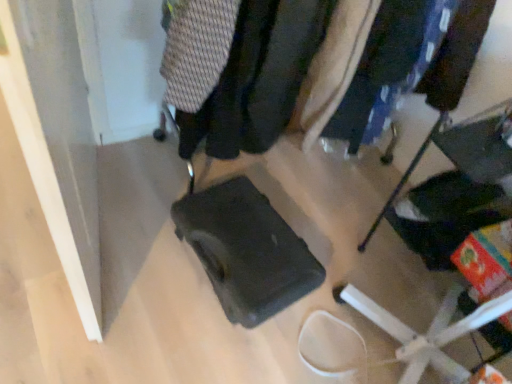
What are the coordinates of `knitted fabric sweater at upper center, which is the 1th clothing in left-to-right order` in the screenshot? It's located at (196, 49).

Locate an element on the screen. matte black suitcase at center is located at coordinates (246, 250).

Locate an element on the screen. matte black backpack at center, which is the second clothing from left to right is located at coordinates (263, 74).

I want to click on matte black suitcase at center, so click(309, 64).

The width and height of the screenshot is (512, 384). In order to click on knitted fabric sweater at upper center, the second clothing positioned from the right in this screenshot , I will do `click(196, 49)`.

From the image's perspective, which one is positioned lower, matte black suitcase at center or matte black suitcase at center?

matte black suitcase at center is shown below in the image.

Considering the sizes of matte black suitcase at center and matte black suitcase at center in the image, is matte black suitcase at center taller or shorter than matte black suitcase at center?

matte black suitcase at center is shorter than matte black suitcase at center.

Can you tell me how much matte black suitcase at center and matte black suitcase at center differ in facing direction?

They differ by 6.98 degrees in their facing directions.

In the scene shown: Which object is wider, matte black suitcase at center or matte black suitcase at center?

Wider between the two is matte black suitcase at center.

Is there a large distance between matte black suitcase at center and knitted fabric sweater at upper center, which is the 1th clothing in left-to-right order?

matte black suitcase at center is near knitted fabric sweater at upper center, which is the 1th clothing in left-to-right order, not far away.

Can you confirm if matte black suitcase at center is thinner than knitted fabric sweater at upper center, the second clothing positioned from the right?

Yes.

Is matte black suitcase at center bigger or smaller than knitted fabric sweater at upper center, the second clothing positioned from the right?

matte black suitcase at center is smaller than knitted fabric sweater at upper center, the second clothing positioned from the right.

Which is more to the right, matte black suitcase at center or knitted fabric sweater at upper center, which is the 1th clothing in left-to-right order?

matte black suitcase at center is more to the right.

Who is bigger, matte black suitcase at center or matte black suitcase at center?

With larger size is matte black suitcase at center.

From the image's perspective, which is below, matte black suitcase at center or matte black suitcase at center?

matte black suitcase at center appears lower in the image.

Would you say matte black suitcase at center contains matte black suitcase at center?

No.

Considering the relative sizes of matte black suitcase at center and matte black suitcase at center in the image provided, is matte black suitcase at center thinner than matte black suitcase at center?

Indeed, matte black suitcase at center has a lesser width compared to matte black suitcase at center.

Would you say matte black suitcase at center is part of matte black suitcase at center's contents?

No, matte black suitcase at center is not a part of matte black suitcase at center.

From a real-world perspective, which is physically below, matte black suitcase at center or matte black suitcase at center?

In real-world perspective, matte black suitcase at center is lower.

From the image's perspective, which is above, matte black suitcase at center or matte black suitcase at center?

matte black suitcase at center is shown above in the image.

Which object is thinner, knitted fabric sweater at upper center, the second clothing positioned from the right, or matte black backpack at center, which is the second clothing from left to right?

matte black backpack at center, which is the second clothing from left to right, is thinner.

From the image's perspective, who appears lower, knitted fabric sweater at upper center, which is the 1th clothing in left-to-right order, or matte black backpack at center, which is the second clothing from left to right?

matte black backpack at center, which is the second clothing from left to right, from the image's perspective.

Who is more distant, knitted fabric sweater at upper center, the second clothing positioned from the right, or matte black backpack at center, which is the second clothing from left to right?

Positioned behind is matte black backpack at center, which is the second clothing from left to right.

Could you tell me if knitted fabric sweater at upper center, the second clothing positioned from the right, is facing matte black backpack at center, marked as the 1th clothing in a right-to-left arrangement?

No.

Looking at this image, can you tell me how much matte black backpack at center, marked as the 1th clothing in a right-to-left arrangement, and matte black suitcase at center differ in facing direction?

64.2 degrees.

Does matte black backpack at center, which is the second clothing from left to right, touch matte black suitcase at center?

No, matte black backpack at center, which is the second clothing from left to right, is not with matte black suitcase at center.

Is matte black backpack at center, which is the second clothing from left to right, inside the boundaries of matte black suitcase at center, or outside?

matte black backpack at center, which is the second clothing from left to right, is outside matte black suitcase at center.

Can you confirm if matte black backpack at center, which is the second clothing from left to right, is bigger than matte black suitcase at center?

Correct, matte black backpack at center, which is the second clothing from left to right, is larger in size than matte black suitcase at center.

Is knitted fabric sweater at upper center, which is the 1th clothing in left-to-right order, positioned far away from matte black suitcase at center?

Actually, knitted fabric sweater at upper center, which is the 1th clothing in left-to-right order, and matte black suitcase at center are a little close together.

From the picture: Is knitted fabric sweater at upper center, which is the 1th clothing in left-to-right order, aimed at matte black suitcase at center?

No.

In the scene shown: Considering the relative sizes of knitted fabric sweater at upper center, which is the 1th clothing in left-to-right order, and matte black suitcase at center in the image provided, is knitted fabric sweater at upper center, which is the 1th clothing in left-to-right order, smaller than matte black suitcase at center?

Yes.

Between knitted fabric sweater at upper center, the second clothing positioned from the right, and matte black suitcase at center, which one has less height?

Standing shorter between the two is knitted fabric sweater at upper center, the second clothing positioned from the right.

At what (x,y) coordinates should I click in order to perform the action: click on furniture positioned vertically above the matte black suitcase at center (from a real-world perspective). Please return your answer as a coordinate pair (x, y). Image resolution: width=512 pixels, height=384 pixels. Looking at the image, I should click on (426, 332).

I want to click on clothing lying on the left of matte black suitcase at center, so click(x=196, y=49).

Which object lies further to the anchor point matte black suitcase at center, matte black suitcase at center or matte black backpack at center, marked as the 1th clothing in a right-to-left arrangement?

Based on the image, matte black suitcase at center appears to be further to matte black suitcase at center.

Consider the image. When comparing their distances from matte black backpack at center, which is the second clothing from left to right, does matte black suitcase at center or knitted fabric sweater at upper center, the second clothing positioned from the right, seem further?

matte black suitcase at center is further to matte black backpack at center, which is the second clothing from left to right.

Which object lies nearer to the anchor point matte black backpack at center, which is the second clothing from left to right, matte black suitcase at center or knitted fabric sweater at upper center, the second clothing positioned from the right?

matte black suitcase at center is positioned closer to the anchor matte black backpack at center, which is the second clothing from left to right.

Based on their spatial positions, is knitted fabric sweater at upper center, the second clothing positioned from the right, or matte black suitcase at center closer to matte black suitcase at center?

matte black suitcase at center lies closer to matte black suitcase at center than the other object.

Estimate the real-world distances between objects in this image. Which object is closer to matte black suitcase at center, matte black suitcase at center or matte black backpack at center, marked as the 1th clothing in a right-to-left arrangement?

Based on the image, matte black backpack at center, marked as the 1th clothing in a right-to-left arrangement, appears to be nearer to matte black suitcase at center.

When comparing their distances from matte black suitcase at center, does matte black backpack at center, marked as the 1th clothing in a right-to-left arrangement, or matte black suitcase at center seem further?

matte black suitcase at center.

From the image, which object appears to be farther from matte black suitcase at center, matte black suitcase at center or knitted fabric sweater at upper center, the second clothing positioned from the right?

knitted fabric sweater at upper center, the second clothing positioned from the right, is positioned further to the anchor matte black suitcase at center.

From the image, which object appears to be nearer to matte black suitcase at center, matte black suitcase at center or matte black suitcase at center?

The object closer to matte black suitcase at center is matte black suitcase at center.

At what (x,y) coordinates should I click in order to perform the action: click on clothing between matte black suitcase at center and matte black suitcase at center in the up-down direction. Please return your answer as a coordinate pair (x, y). Looking at the image, I should click on (263, 74).

Locate an element on the screen. clothing between knitted fabric sweater at upper center, which is the 1th clothing in left-to-right order, and matte black suitcase at center from left to right is located at coordinates click(x=263, y=74).

This screenshot has height=384, width=512. In order to click on clothing located between matte black suitcase at center and matte black backpack at center, which is the second clothing from left to right, in the depth direction in this screenshot , I will do `click(196, 49)`.

The width and height of the screenshot is (512, 384). I want to click on closet that lies between knitted fabric sweater at upper center, the second clothing positioned from the right, and matte black suitcase at center from top to bottom, so (x=309, y=64).